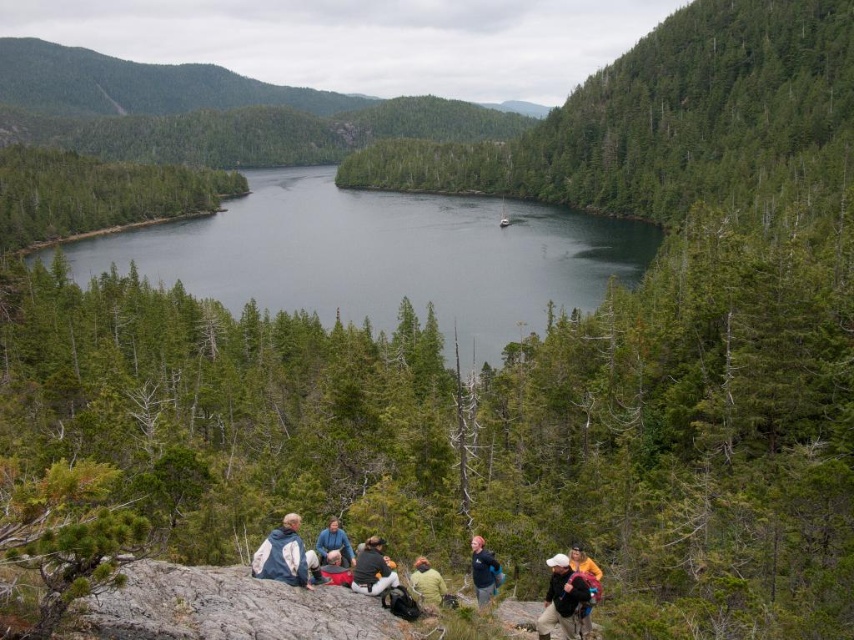
Question: Which is farther from the blue fabric jacket at lower center?

Choices:
 (A) white fleece jacket at lower center
 (B) khaki cotton pants at lower right

Answer: (A)

Question: Does blue fabric jacket at lower center have a lesser width compared to blue fabric jacket at center?

Choices:
 (A) yes
 (B) no

Answer: (A)

Question: Among these points, which one is farthest from the camera?

Choices:
 (A) (336, 564)
 (B) (130, 244)
 (C) (366, 544)
 (D) (477, 605)

Answer: (B)

Question: Which of the following is the closest to the observer?

Choices:
 (A) (586, 602)
 (B) (367, 544)
 (C) (490, 576)

Answer: (A)

Question: Can you confirm if dark green water at center is positioned to the right of white fleece jacket at lower center?

Choices:
 (A) yes
 (B) no

Answer: (B)

Question: Is orange fleece jacket at lower right to the left of red fabric bag at center from the viewer's perspective?

Choices:
 (A) yes
 (B) no

Answer: (B)